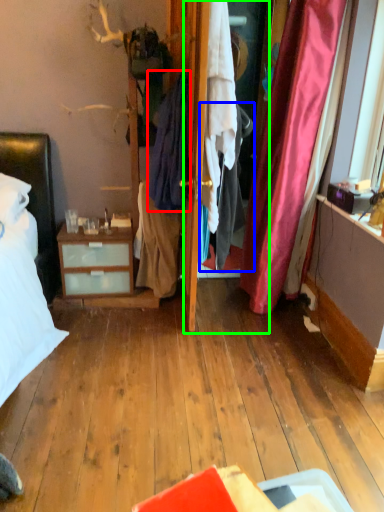
Question: Which is farther away from clothing (highlighted by a red box)? clothing (highlighted by a blue box) or screen door (highlighted by a green box)?

Choices:
 (A) clothing
 (B) screen door

Answer: (A)